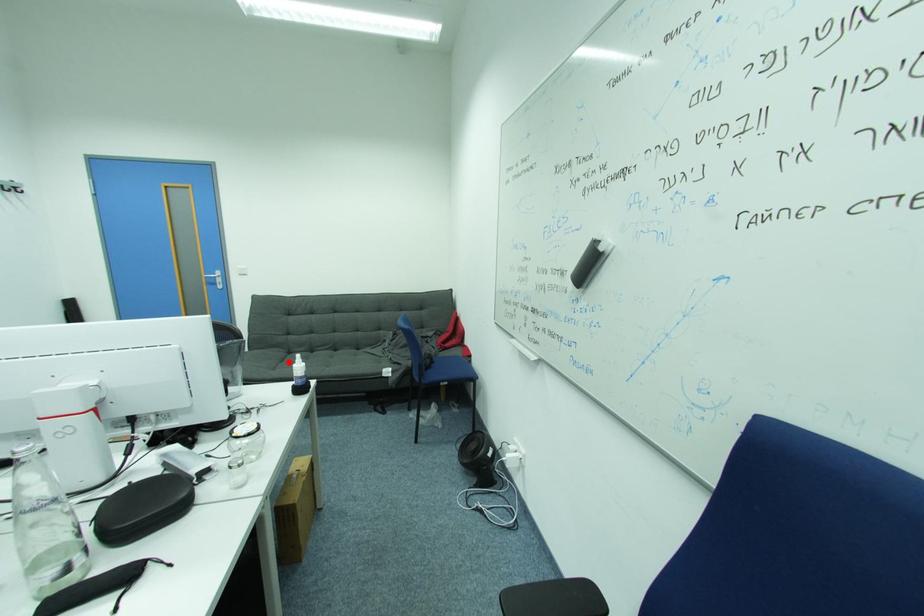
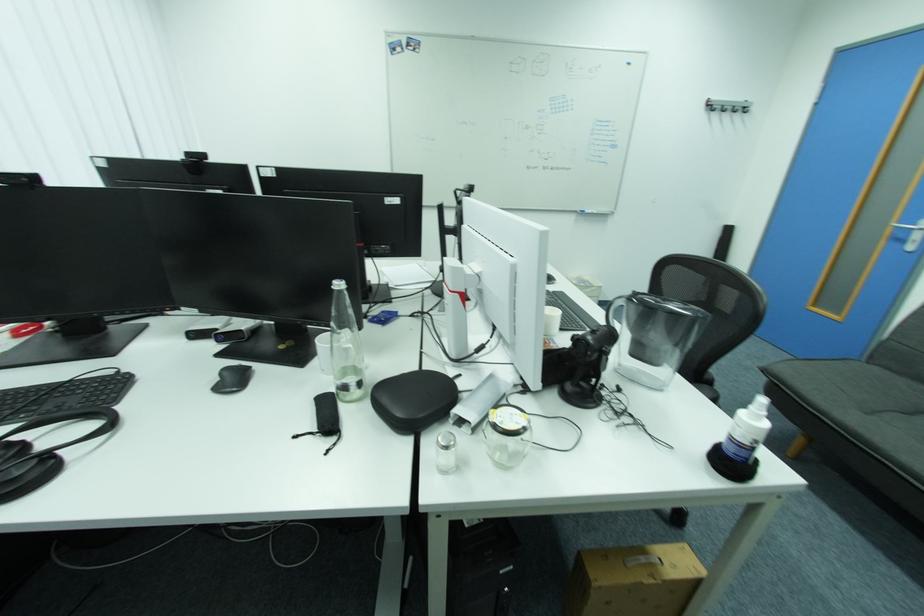
Find the pixel in the second image that matches the highlighted location in the first image.

(917, 415)